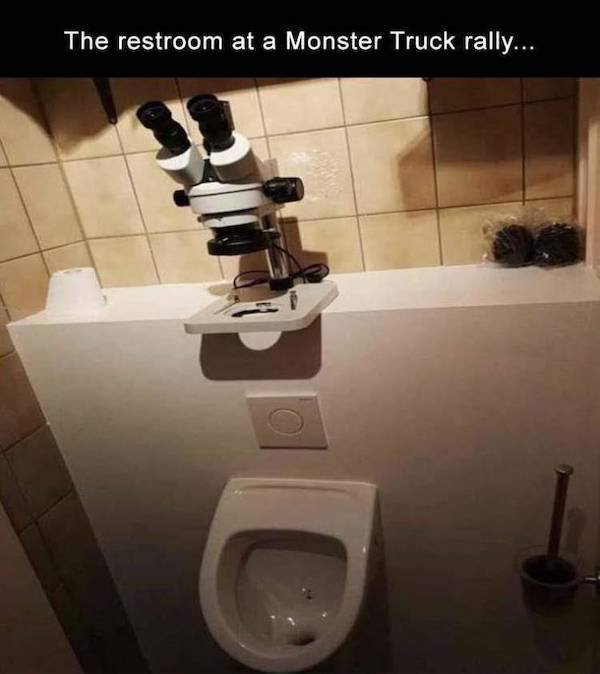
You are a GUI agent. You are given a task and a screenshot of the screen. Output one action in this format:
    pyautogui.click(x=<x>, y=<y>)
    Task: Click on the brush cupholder
    
    Given the screenshot: What is the action you would take?
    pyautogui.click(x=565, y=598)